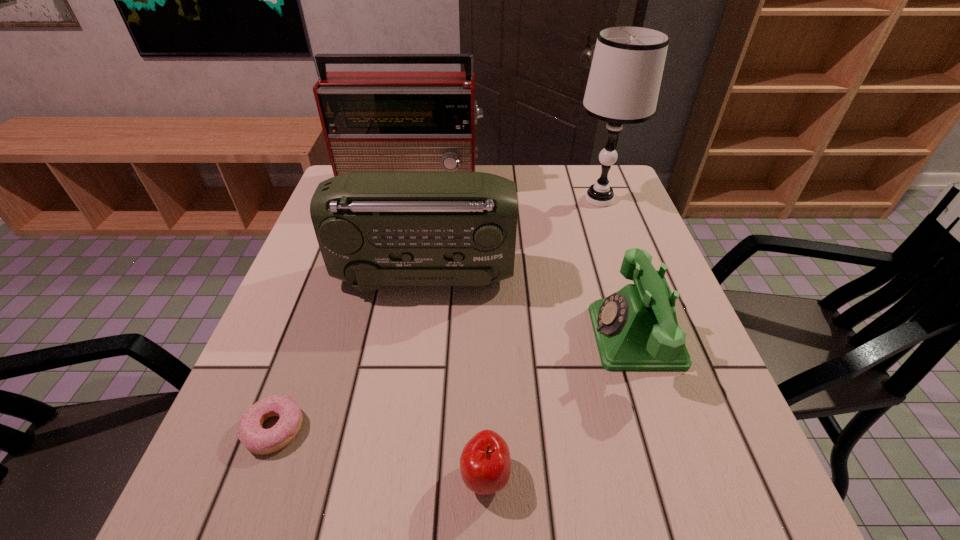
Find the location of a particular element. table lamp is located at coordinates (624, 81).

Locate an element on the screen. the fifth shortest object is located at coordinates (372, 121).

Where is `the taller radio_receiver`? This screenshot has width=960, height=540. the taller radio_receiver is located at coordinates (372, 121).

This screenshot has height=540, width=960. What are the coordinates of `the shorter radio_receiver` in the screenshot? It's located at (374, 229).

Locate an element on the screen. This screenshot has height=540, width=960. the nearer radio_receiver is located at coordinates (374, 229).

Where is `the third shortest object`? the third shortest object is located at coordinates (636, 329).

Locate an element on the screen. This screenshot has height=540, width=960. apple is located at coordinates (485, 463).

Locate an element on the screen. The height and width of the screenshot is (540, 960). doughnut is located at coordinates (257, 440).

Where is `vacant area situated 0.330m on the front of the table lamp`? This screenshot has width=960, height=540. vacant area situated 0.330m on the front of the table lamp is located at coordinates (637, 306).

You are a GUI agent. You are given a task and a screenshot of the screen. Output one action in this format:
    pyautogui.click(x=<x>, y=<y>)
    Task: Click on the vacant point located on the front-facing side of the fifth shortest object
    The height and width of the screenshot is (540, 960).
    Given the screenshot: What is the action you would take?
    pyautogui.click(x=403, y=232)